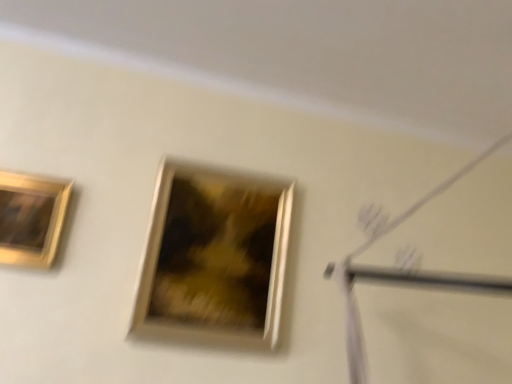
Question: From the image's perspective, is gold metallic picture frame at center, arranged as the second picture frame when viewed from the left, beneath gold metallic picture frame at upper left, which is the 1th picture frame in left-to-right order?

Choices:
 (A) no
 (B) yes

Answer: (B)

Question: Does gold metallic picture frame at center, arranged as the first picture frame when viewed from the right, have a lesser width compared to gold metallic picture frame at upper left, which is counted as the second picture frame, starting from the right?

Choices:
 (A) yes
 (B) no

Answer: (B)

Question: From a real-world perspective, is gold metallic picture frame at center, arranged as the second picture frame when viewed from the left, beneath gold metallic picture frame at upper left, which is the 1th picture frame in left-to-right order?

Choices:
 (A) no
 (B) yes

Answer: (B)

Question: Is gold metallic picture frame at center, arranged as the second picture frame when viewed from the left, aimed at gold metallic picture frame at upper left, which is the 1th picture frame in left-to-right order?

Choices:
 (A) no
 (B) yes

Answer: (A)

Question: Does gold metallic picture frame at center, arranged as the first picture frame when viewed from the right, have a greater width compared to gold metallic picture frame at upper left, which is counted as the second picture frame, starting from the right?

Choices:
 (A) no
 (B) yes

Answer: (B)

Question: Considering the relative sizes of gold metallic picture frame at center, arranged as the second picture frame when viewed from the left, and gold metallic picture frame at upper left, which is the 1th picture frame in left-to-right order, in the image provided, is gold metallic picture frame at center, arranged as the second picture frame when viewed from the left, taller than gold metallic picture frame at upper left, which is the 1th picture frame in left-to-right order,?

Choices:
 (A) no
 (B) yes

Answer: (B)

Question: Does gold metallic picture frame at upper left, which is counted as the second picture frame, starting from the right, have a larger size compared to gold metallic picture frame at center, arranged as the first picture frame when viewed from the right?

Choices:
 (A) no
 (B) yes

Answer: (A)

Question: Is gold metallic picture frame at upper left, which is counted as the second picture frame, starting from the right, wider than gold metallic picture frame at center, arranged as the second picture frame when viewed from the left?

Choices:
 (A) no
 (B) yes

Answer: (A)

Question: Is gold metallic picture frame at upper left, which is the 1th picture frame in left-to-right order, completely or partially outside of gold metallic picture frame at center, arranged as the second picture frame when viewed from the left?

Choices:
 (A) yes
 (B) no

Answer: (A)

Question: Does gold metallic picture frame at upper left, which is the 1th picture frame in left-to-right order, contain gold metallic picture frame at center, arranged as the second picture frame when viewed from the left?

Choices:
 (A) yes
 (B) no

Answer: (B)

Question: Are gold metallic picture frame at upper left, which is counted as the second picture frame, starting from the right, and gold metallic picture frame at center, arranged as the second picture frame when viewed from the left, far apart?

Choices:
 (A) no
 (B) yes

Answer: (A)

Question: Is gold metallic picture frame at upper left, which is the 1th picture frame in left-to-right order, in front of gold metallic picture frame at center, arranged as the first picture frame when viewed from the right?

Choices:
 (A) no
 (B) yes

Answer: (B)

Question: Considering the positions of point (25, 253) and point (221, 314), is point (25, 253) closer or farther from the camera than point (221, 314)?

Choices:
 (A) closer
 (B) farther

Answer: (A)